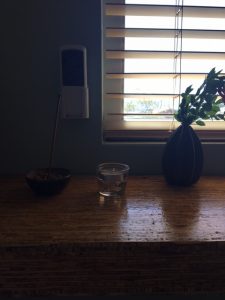
Find the location of a particular element. The image size is (225, 300). window frame is located at coordinates (110, 105).